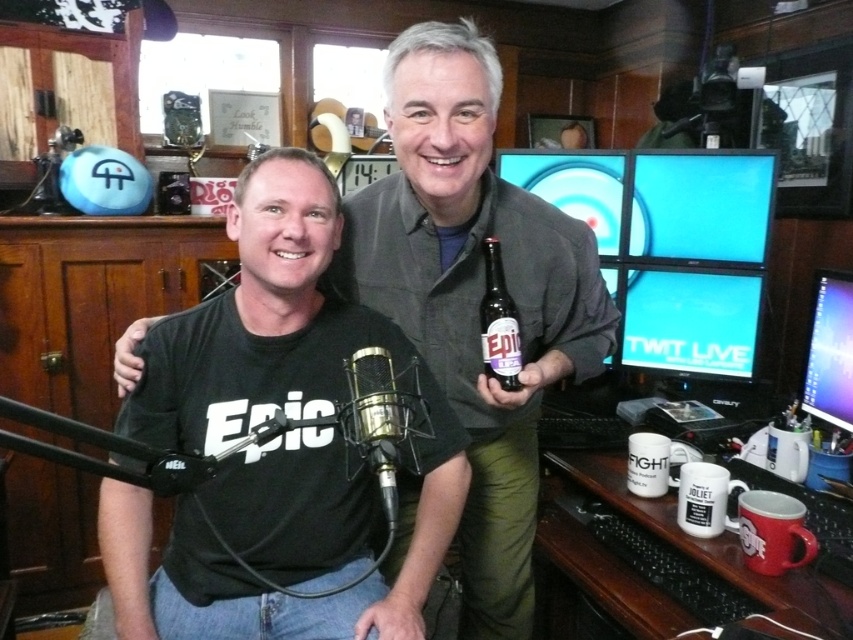
Question: Which object appears closest to the camera in this image?

Choices:
 (A) black metallic microphone at center
 (B) matte black monitor at center right

Answer: (A)

Question: Is black matte t-shirt at center to the right of glossy plastic monitor at upper right from the viewer's perspective?

Choices:
 (A) yes
 (B) no

Answer: (B)

Question: Can you confirm if black matte t-shirt at center is smaller than matte black monitor at upper right?

Choices:
 (A) no
 (B) yes

Answer: (A)

Question: Which point appears farthest from the camera in this image?

Choices:
 (A) (363, 419)
 (B) (558, 157)

Answer: (B)

Question: Among these objects, which one is nearest to the camera?

Choices:
 (A) matte black monitor at upper center
 (B) matte black monitor at upper right
 (C) black metallic microphone at center
 (D) matte glass bottle at center

Answer: (C)

Question: Is black metallic microphone at center to the left of matte glass bottle at center from the viewer's perspective?

Choices:
 (A) yes
 (B) no

Answer: (A)